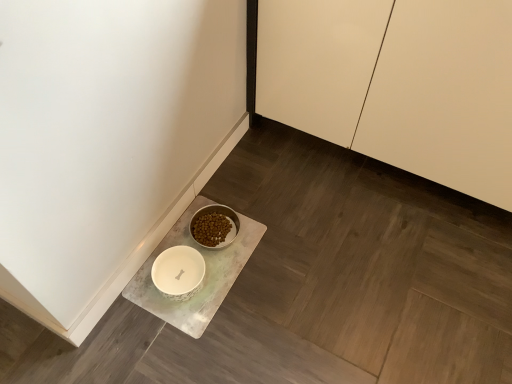
Question: In terms of width, does white glossy cabinet at upper right look wider or thinner when compared to white marble tray at lower left?

Choices:
 (A) thin
 (B) wide

Answer: (B)

Question: From the image's perspective, is white glossy cabinet at upper right above or below white marble tray at lower left?

Choices:
 (A) above
 (B) below

Answer: (A)

Question: Based on their positions, is white glossy cabinet at upper right located to the left or right of white marble tray at lower left?

Choices:
 (A) left
 (B) right

Answer: (B)

Question: In terms of size, does white marble tray at lower left appear bigger or smaller than white glossy cabinet at upper right?

Choices:
 (A) small
 (B) big

Answer: (A)

Question: Is point (202, 332) positioned closer to the camera than point (502, 185)?

Choices:
 (A) farther
 (B) closer

Answer: (B)

Question: From a real-world perspective, relative to white glossy cabinet at upper right, is white marble tray at lower left vertically above or below?

Choices:
 (A) above
 (B) below

Answer: (B)

Question: In terms of height, does white marble tray at lower left look taller or shorter compared to white glossy cabinet at upper right?

Choices:
 (A) tall
 (B) short

Answer: (B)